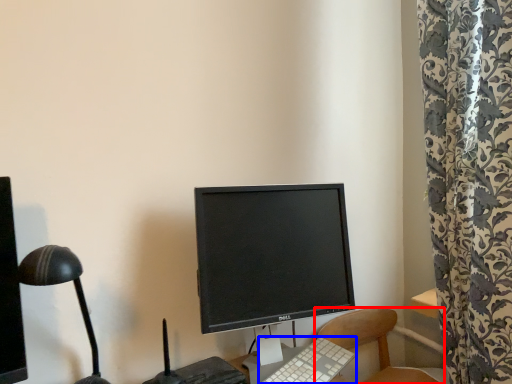
Question: Which object appears farthest to the camera in this image, chair (highlighted by a red box) or computer keyboard (highlighted by a blue box)?

Choices:
 (A) chair
 (B) computer keyboard

Answer: (A)